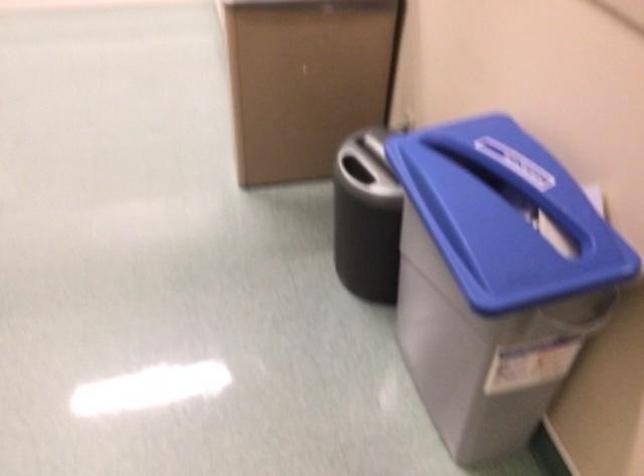
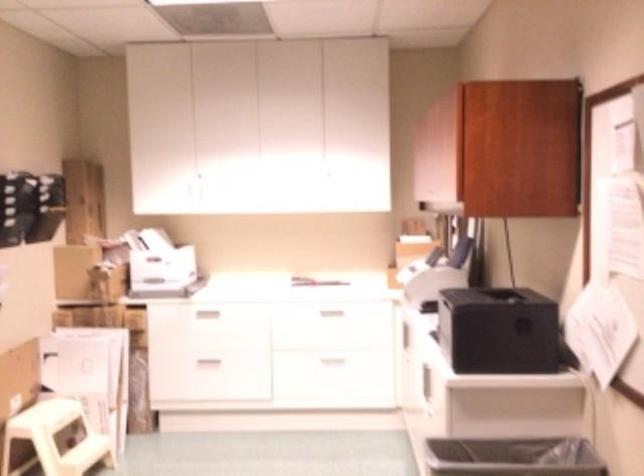
Based on the continuous images, in which direction is the camera rotating?

The camera's rotation is toward left-up.